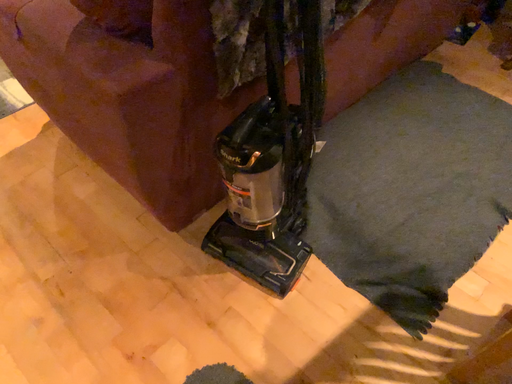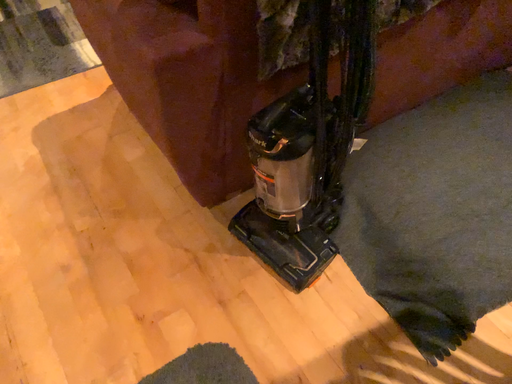
Question: How did the camera likely rotate when shooting the video?

Choices:
 (A) rotated left
 (B) rotated right

Answer: (A)